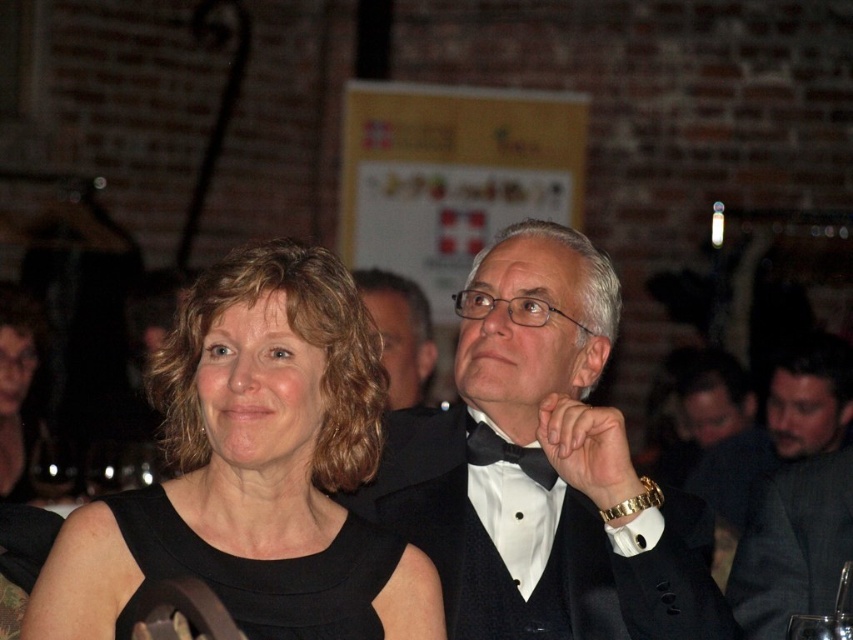
Question: Is black fabric dress at left thinner than dark gray suit at right?

Choices:
 (A) yes
 (B) no

Answer: (B)

Question: Does black satin tuxedo at center appear on the right side of matte black suit at center?

Choices:
 (A) no
 (B) yes

Answer: (B)

Question: Can you confirm if black fabric dress at left is thinner than black satin tuxedo at center?

Choices:
 (A) yes
 (B) no

Answer: (A)

Question: Among these objects, which one is nearest to the camera?

Choices:
 (A) matte black suit at center
 (B) black satin dress at center
 (C) black satin bow tie at center

Answer: (B)

Question: Which point is farther to the camera?

Choices:
 (A) matte black suit at center
 (B) dark gray suit at right
 (C) black satin bow tie at center
 (D) black satin tuxedo at center

Answer: (B)

Question: Which of the following is the farthest from the observer?

Choices:
 (A) (778, 476)
 (B) (483, 440)
 (C) (416, 432)

Answer: (C)